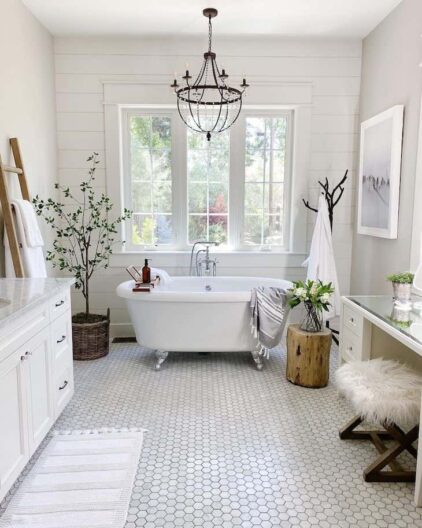
In order to click on potted tree in this screenshot , I will do `click(86, 299)`.